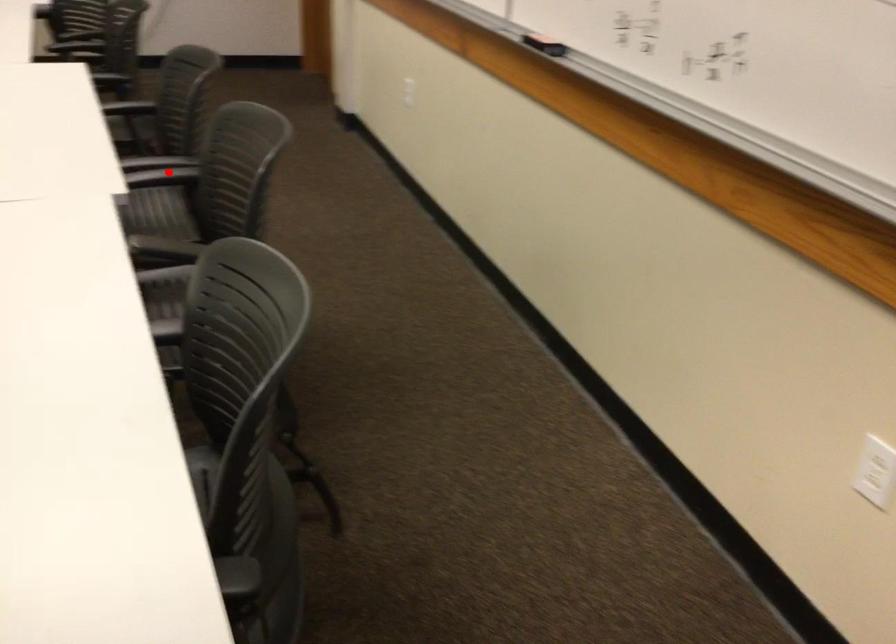
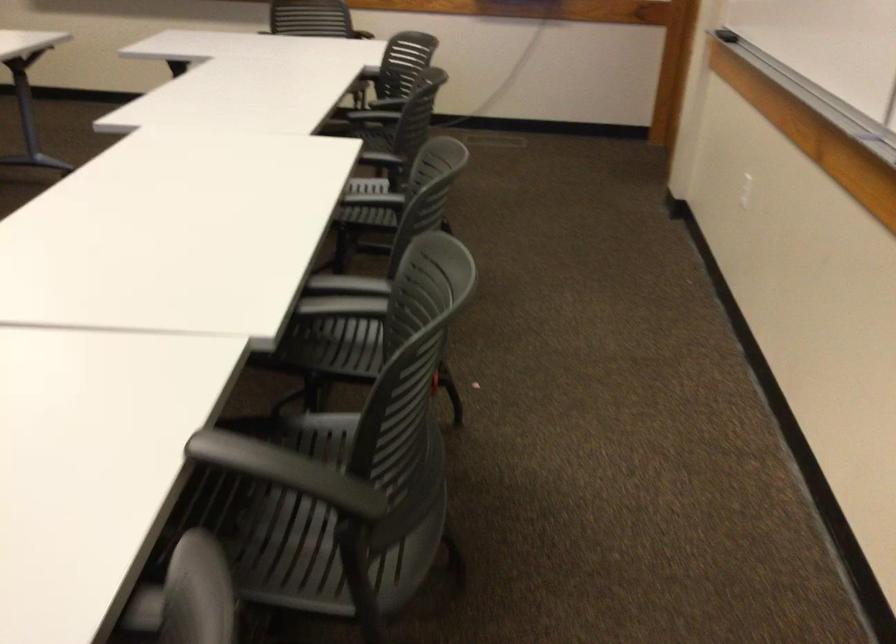
Find the pixel in the second image that matches the highlighted location in the first image.

(343, 297)